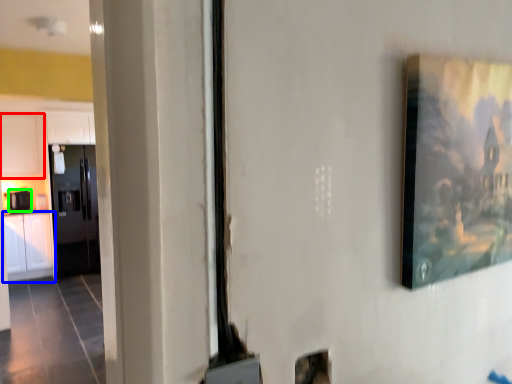
Question: Which object is the closest to the cabinetry (highlighted by a red box)? Choose among these: cabinetry (highlighted by a blue box) or appliance (highlighted by a green box).

Choices:
 (A) cabinetry
 (B) appliance

Answer: (B)